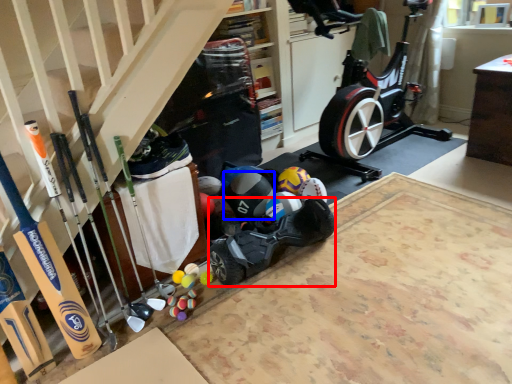
Question: Among these objects, which one is nearest to the camera, car (highlighted by a red box) or sports equipment (highlighted by a blue box)?

Choices:
 (A) car
 (B) sports equipment

Answer: (A)